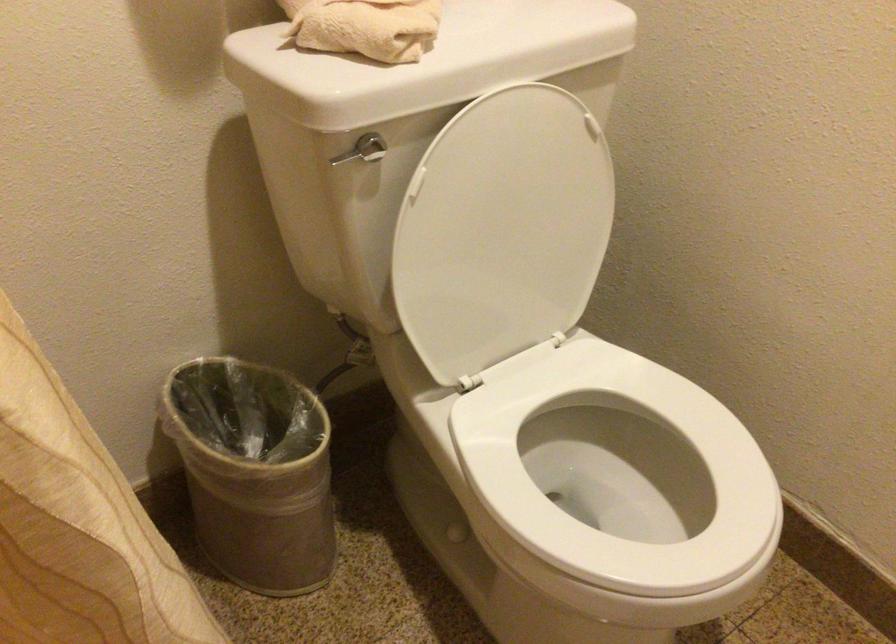
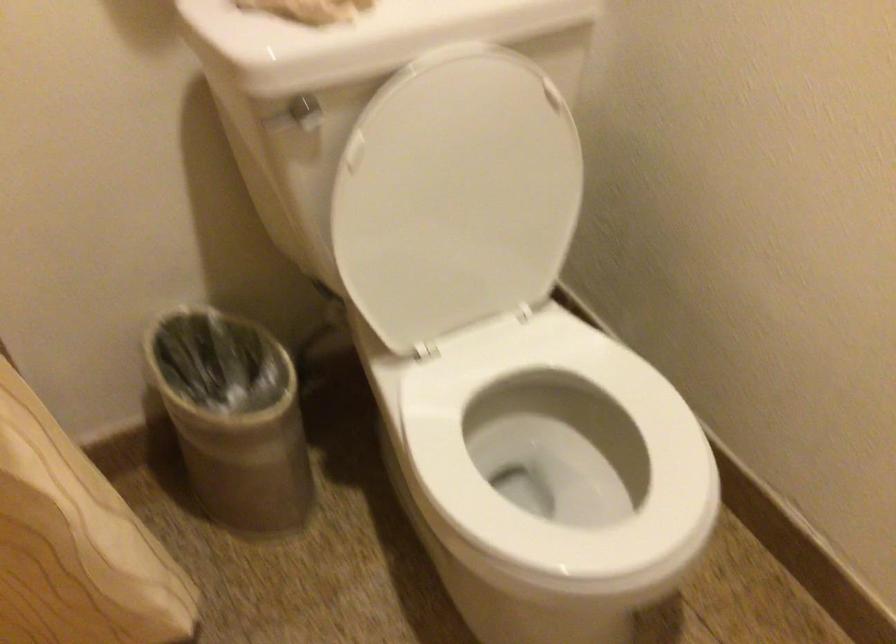
Question: Based on the continuous images, in which direction is the camera rotating? Reply with the corresponding letter.

Choices:
 (A) Left
 (B) Right
 (C) Up
 (D) Down

Answer: (A)